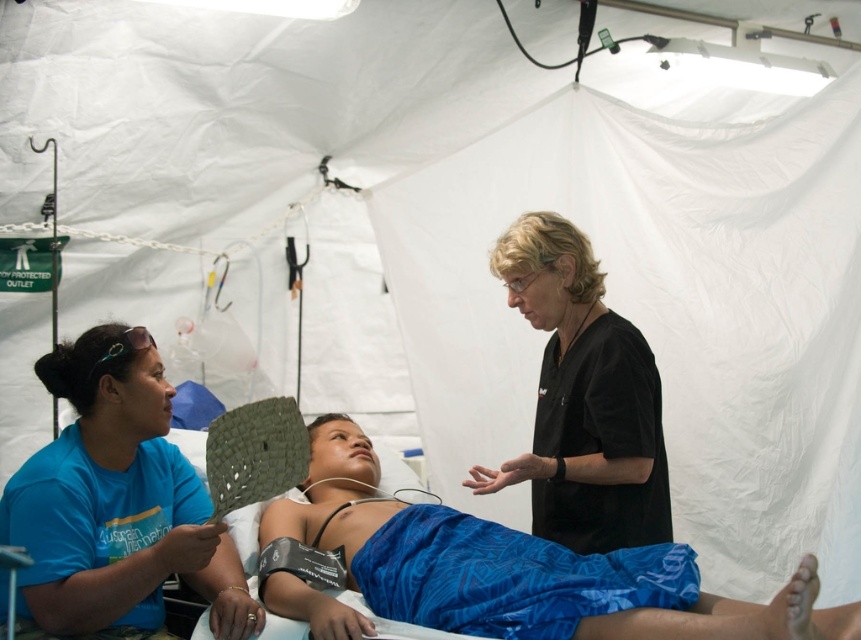
Based on the scene described, where is the blue fabric at center located in relation to the patient?

The blue fabric at center is located at point (554, 582), which is near the patient.

You are a nurse in the makeshift hospital. You need to locate the blue fabric shirt at left and the black scrubs at center. Which one is closer to the patient lying on the cot?

The blue fabric shirt at left is in front of the black scrubs at center, so it is closer to the patient.